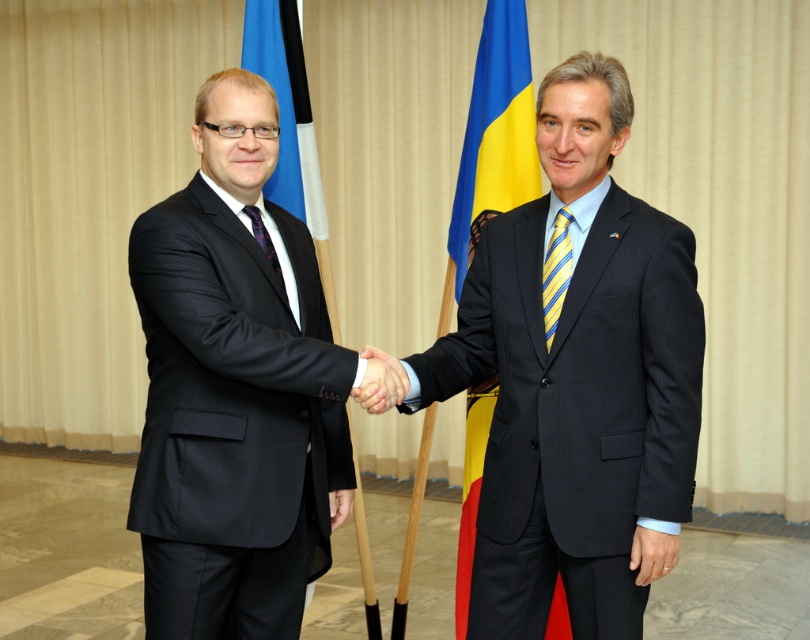
Is yellowmaterial/textureflag at right behind purple satin tie at left?

Yes, it is behind purple satin tie at left.

The width and height of the screenshot is (810, 640). I want to click on yellowmaterial/textureflag at right, so click(495, 132).

Can you confirm if dark pinstripe suit at center is smaller than purple satin tie at left?

Incorrect, dark pinstripe suit at center is not smaller in size than purple satin tie at left.

Image resolution: width=810 pixels, height=640 pixels. Identify the location of dark pinstripe suit at center. (578, 381).

At what (x,y) coordinates should I click in order to perform the action: click on dark pinstripe suit at center. Please return your answer as a coordinate pair (x, y). The width and height of the screenshot is (810, 640). Looking at the image, I should click on (578, 381).

Who is taller, yellowmaterial/textureflag at right or blue fabric flag at left?

Standing taller between the two is blue fabric flag at left.

The width and height of the screenshot is (810, 640). Find the location of `yellowmaterial/textureflag at right`. yellowmaterial/textureflag at right is located at coordinates [x=495, y=132].